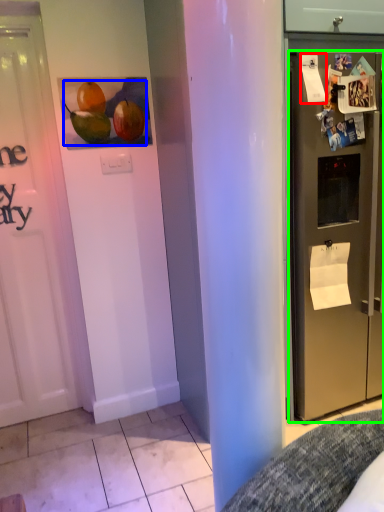
Question: Based on their relative distances, which object is farther from paper (highlighted by a red box)? Choose from fruit (highlighted by a blue box) and refrigerator (highlighted by a green box).

Choices:
 (A) fruit
 (B) refrigerator

Answer: (A)